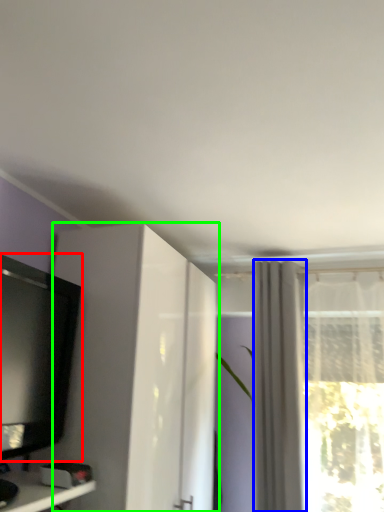
Question: Which object is the farthest from television (highlighted by a red box)? Choose among these: curtain (highlighted by a blue box) or cabinetry (highlighted by a green box).

Choices:
 (A) curtain
 (B) cabinetry

Answer: (A)